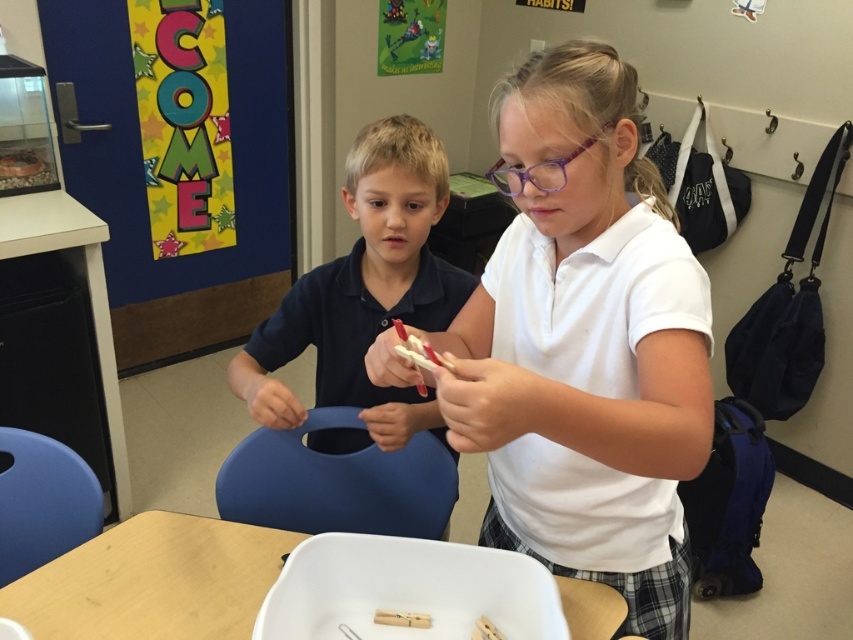
Question: In this image, where is wooden table at center located relative to wooden clothespin at center?

Choices:
 (A) left
 (B) right

Answer: (A)

Question: Which point is closer to the camera?

Choices:
 (A) wooden table at center
 (B) wooden clothespin at center
 (C) matte blue shirt at center

Answer: (A)

Question: Which point is farther to the camera?

Choices:
 (A) (373, 285)
 (B) (413, 618)

Answer: (A)

Question: Is white matte shirt at center to the right of wooden table at center from the viewer's perspective?

Choices:
 (A) yes
 (B) no

Answer: (A)

Question: Which object is closer to the camera taking this photo?

Choices:
 (A) wooden clothespin at center
 (B) matte blue shirt at center
 (C) wooden table at center
 (D) white matte shirt at center

Answer: (D)

Question: Is white matte shirt at center further to camera compared to wooden clothespin at center?

Choices:
 (A) yes
 (B) no

Answer: (B)